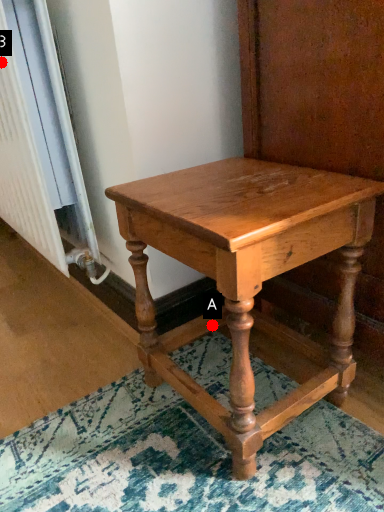
Question: Two points are circled on the image, labeled by A and B beside each circle. Among these points, which one is nearest to the camera?

Choices:
 (A) A is closer
 (B) B is closer

Answer: (B)